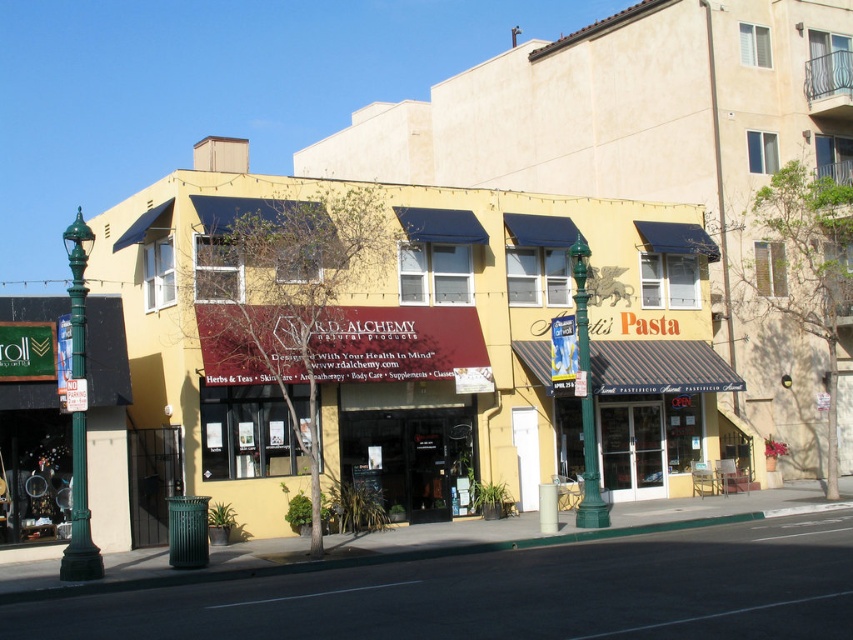
Question: Can you confirm if green polished metal streetlight at left is thinner than green metal pole at center?

Choices:
 (A) yes
 (B) no

Answer: (B)

Question: Which point is closer to the camera taking this photo?

Choices:
 (A) (74, 296)
 (B) (583, 241)

Answer: (A)

Question: Which point is closer to the camera?

Choices:
 (A) green metal pole at center
 (B) green polished metal streetlight at left

Answer: (B)

Question: Is green polished metal streetlight at left wider than green metal pole at center?

Choices:
 (A) no
 (B) yes

Answer: (B)

Question: Observing the image, what is the correct spatial positioning of green polished metal streetlight at left in reference to green metal pole at center?

Choices:
 (A) below
 (B) above

Answer: (B)

Question: Among these points, which one is nearest to the camera?

Choices:
 (A) (577, 244)
 (B) (71, 310)

Answer: (B)